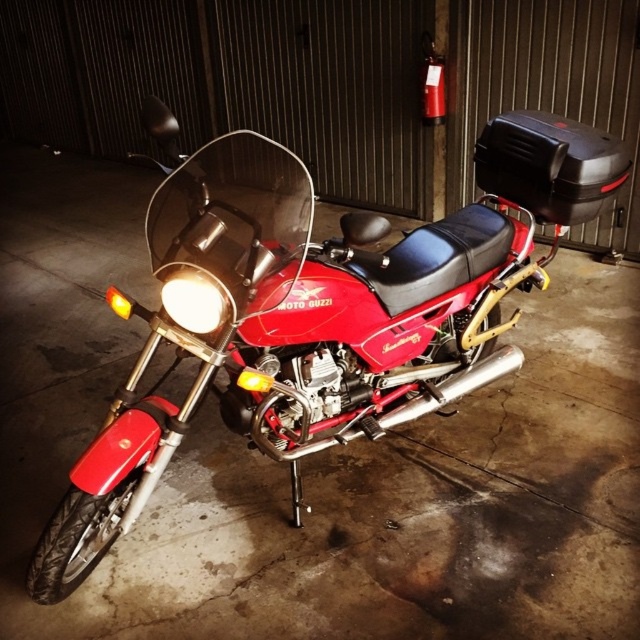
The image size is (640, 640). Describe the element at coordinates (323, 312) in the screenshot. I see `shiny red motorcycle at center` at that location.

Is shiny red motorcycle at center thinner than matte white headlight at center?

No.

Is point (513, 257) positioned before point (224, 323)?

No, (513, 257) is behind (224, 323).

In order to click on shiny red motorcycle at center in this screenshot , I will do `click(323, 312)`.